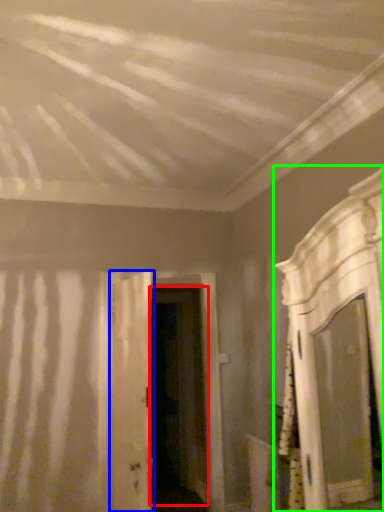
Question: Which is farther away from door (highlighted by a red box)? door (highlighted by a blue box) or furniture (highlighted by a green box)?

Choices:
 (A) door
 (B) furniture

Answer: (B)